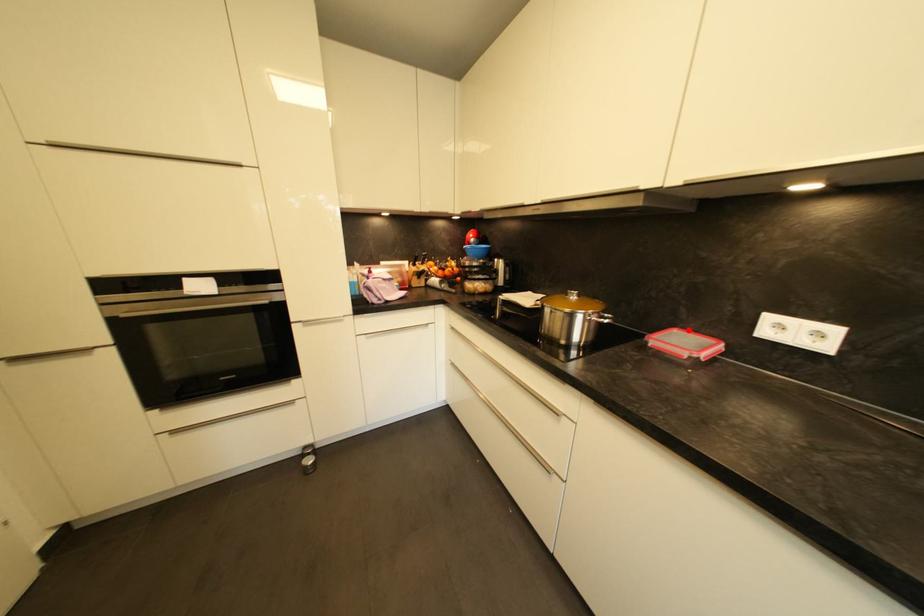
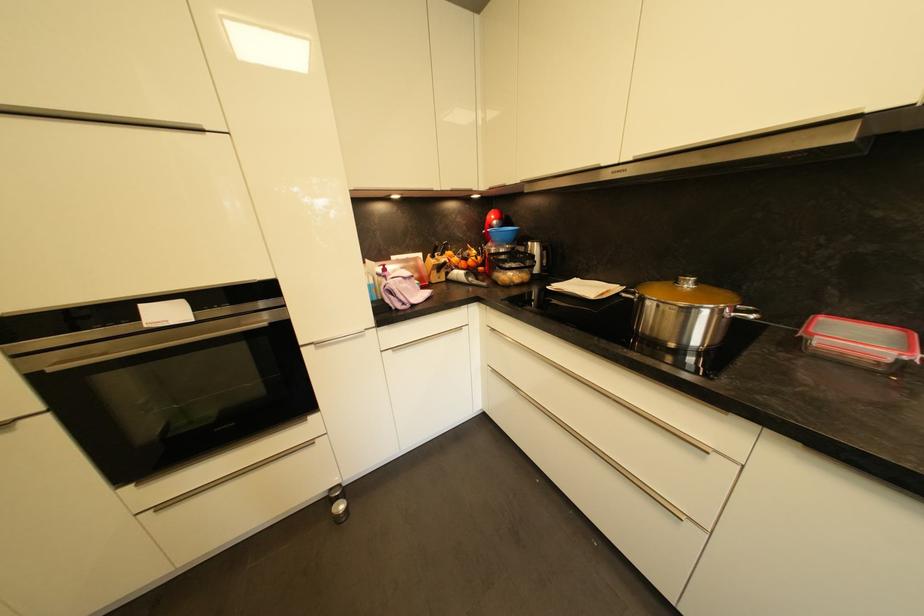
In the second image, find the point that corresponds to the highlighted location in the first image.

(836, 315)